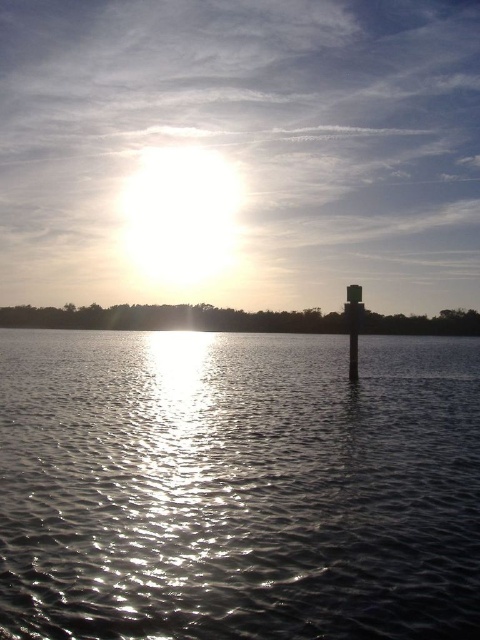
You are a photographer standing at the lakeside. You want to capture a photo where the smooth concrete pillar at center is fully visible without being covered by the glistening silver water at center. Based on the scene description, can you adjust your position or angle to achieve this?

The glistening silver water at center is taller than smooth concrete pillar at center, so if you lower your camera angle or move closer to the water, the pillar will appear higher relative to the water and remain visible in the frame.

You are standing at the lakeside and want to walk from the glistening silver water at center to the smooth concrete pillar at center. Which direction should you move to reach the pillar?

You should move forward because the smooth concrete pillar at center is farther away from you than the glistening silver water at center.

You are standing on the lakeshore and see the glistening silver water at center and the smooth concrete pillar at center. Which object is located directly above the other?

The smooth concrete pillar at center is positioned above the glistening silver water at center.